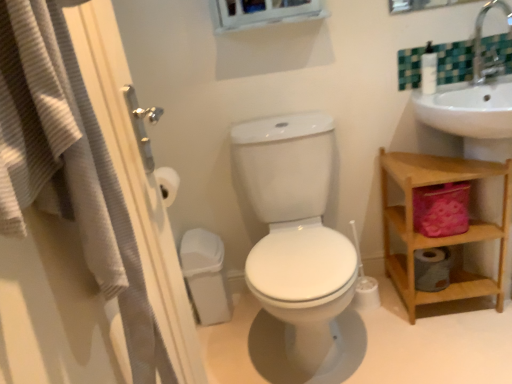
Question: Is white glossy toilet at center bigger or smaller than white plastic soap dispenser at upper right?

Choices:
 (A) small
 (B) big

Answer: (B)

Question: Considering their positions, is white glossy toilet at center located in front of or behind white plastic soap dispenser at upper right?

Choices:
 (A) behind
 (B) front

Answer: (B)

Question: Which object is positioned farthest from the wooden shelf at right?

Choices:
 (A) silver metallic faucet at upper right
 (B) white textured screen door at left
 (C) white glossy toilet at center
 (D) white plastic soap dispenser at upper right

Answer: (B)

Question: Estimate the real-world distances between objects in this image. Which object is farther from the wooden shelf at right?

Choices:
 (A) white textured screen door at left
 (B) white plastic soap dispenser at upper right
 (C) silver metallic faucet at upper right
 (D) white glossy toilet at center

Answer: (A)